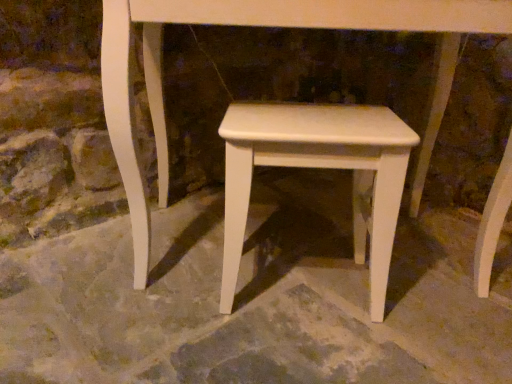
Question: Visually, is white matte stool at center positioned to the left or to the right of white smooth concrete at center?

Choices:
 (A) left
 (B) right

Answer: (B)

Question: Considering the positions of white matte stool at center and white smooth concrete at center in the image, is white matte stool at center taller or shorter than white smooth concrete at center?

Choices:
 (A) short
 (B) tall

Answer: (B)

Question: Does point (230, 165) appear closer or farther from the camera than point (398, 286)?

Choices:
 (A) closer
 (B) farther

Answer: (A)

Question: Is point (323, 362) positioned closer to the camera than point (233, 238)?

Choices:
 (A) farther
 (B) closer

Answer: (B)

Question: From the image's perspective, is white smooth concrete at center positioned above or below white matte stool at center?

Choices:
 (A) below
 (B) above

Answer: (A)

Question: In terms of height, does white smooth concrete at center look taller or shorter compared to white matte stool at center?

Choices:
 (A) short
 (B) tall

Answer: (A)

Question: From a real-world perspective, is white smooth concrete at center above or below white matte stool at center?

Choices:
 (A) below
 (B) above

Answer: (A)